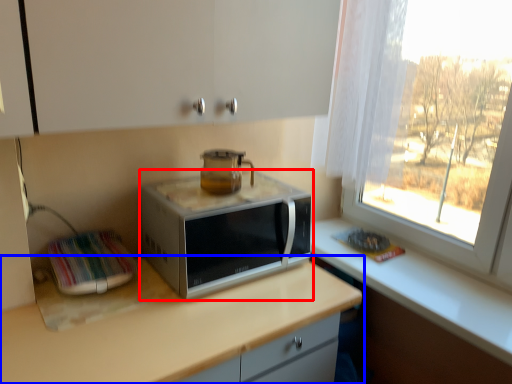
Question: Among these objects, which one is farthest to the camera, microwave oven (highlighted by a red box) or countertop (highlighted by a blue box)?

Choices:
 (A) microwave oven
 (B) countertop

Answer: (A)